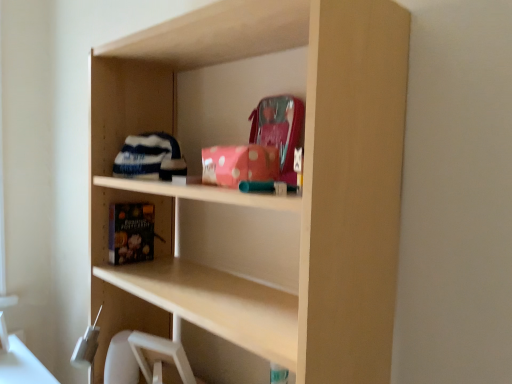
Question: From the image's perspective, relative to pink polka dot fabric at upper center, the 1th book positioned from the top, is black matte book at lower left, the 1th book in the back-to-front sequence, above or below?

Choices:
 (A) above
 (B) below

Answer: (B)

Question: Which is correct: black matte book at lower left, the 1th book in the back-to-front sequence, is inside pink polka dot fabric at upper center, placed as the 2th book when sorted from bottom to top, or outside of it?

Choices:
 (A) inside
 (B) outside

Answer: (B)

Question: From a real-world perspective, is black matte book at lower left, the 2th book viewed from the front, above or below pink polka dot fabric at upper center, placed as the 2th book when sorted from bottom to top?

Choices:
 (A) below
 (B) above

Answer: (A)

Question: From the image's perspective, is pink polka dot fabric at upper center, placed as the 2th book when sorted from bottom to top, located above or below black matte book at lower left, placed as the first book when sorted from bottom to top?

Choices:
 (A) below
 (B) above

Answer: (B)

Question: Does point (252, 160) appear closer or farther from the camera than point (110, 210)?

Choices:
 (A) closer
 (B) farther

Answer: (A)

Question: Based on their positions, is pink polka dot fabric at upper center, the second book positioned from the left, located to the left or right of black matte book at lower left, placed as the first book when sorted from bottom to top?

Choices:
 (A) left
 (B) right

Answer: (B)

Question: From a real-world perspective, relative to black matte book at lower left, marked as the 2th book in a right-to-left arrangement, is pink polka dot fabric at upper center, the 1th book positioned from the top, vertically above or below?

Choices:
 (A) below
 (B) above

Answer: (B)